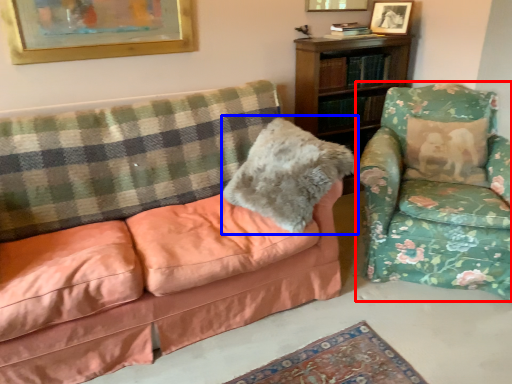
Question: Which point is closer to the camera, chair (highlighted by a red box) or throw pillow (highlighted by a blue box)?

Choices:
 (A) chair
 (B) throw pillow

Answer: (A)